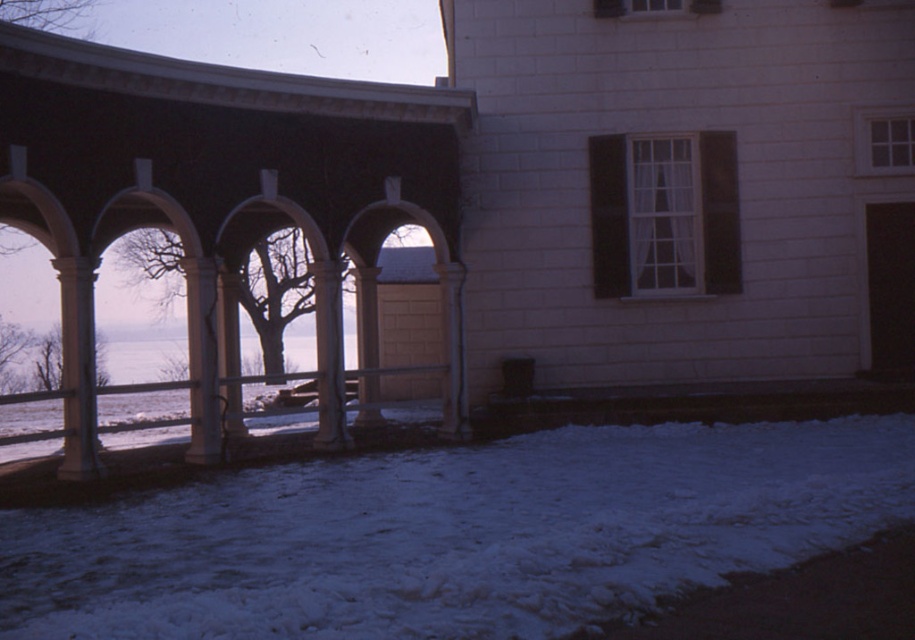
Who is shorter, white marble pillar at center or white stone pillar at center?

With less height is white marble pillar at center.

Is point (191, 442) positioned in front of point (225, 388)?

Yes.

Find the location of a particular element. The width and height of the screenshot is (915, 640). white marble pillar at center is located at coordinates (202, 360).

Can you confirm if white stone archway at left is wider than white marble pillar at center?

No.

Is point (179, 170) farther from viewer compared to point (210, 356)?

No.

This screenshot has width=915, height=640. What are the coordinates of `white stone archway at left` in the screenshot? It's located at (227, 161).

Which of these two, white marble pillar at center or white stone column at center, stands shorter?

white stone column at center is shorter.

Between point (212, 326) and point (325, 444), which one is positioned in front?

Point (212, 326) is in front.

Find the location of `white marble pillar at center`. white marble pillar at center is located at coordinates (202, 360).